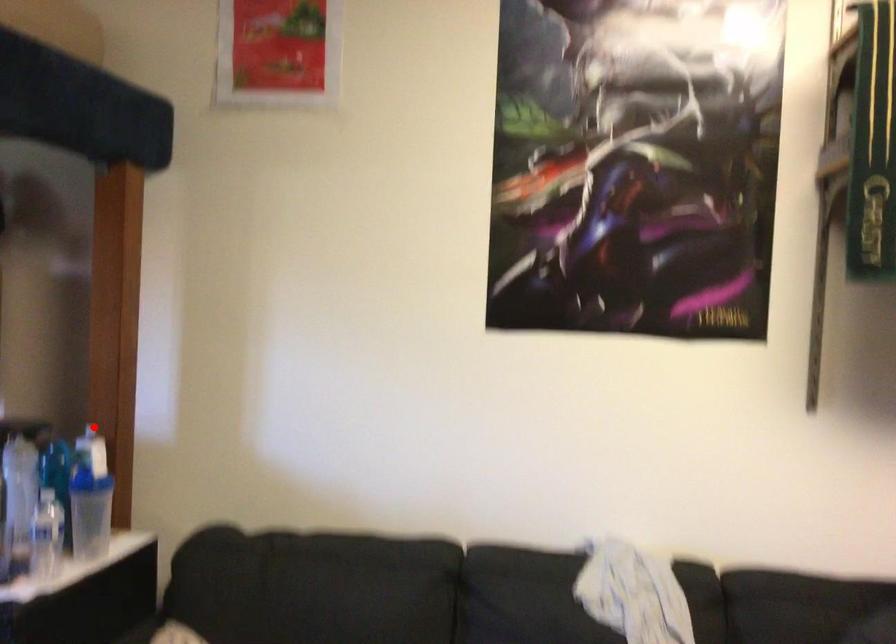
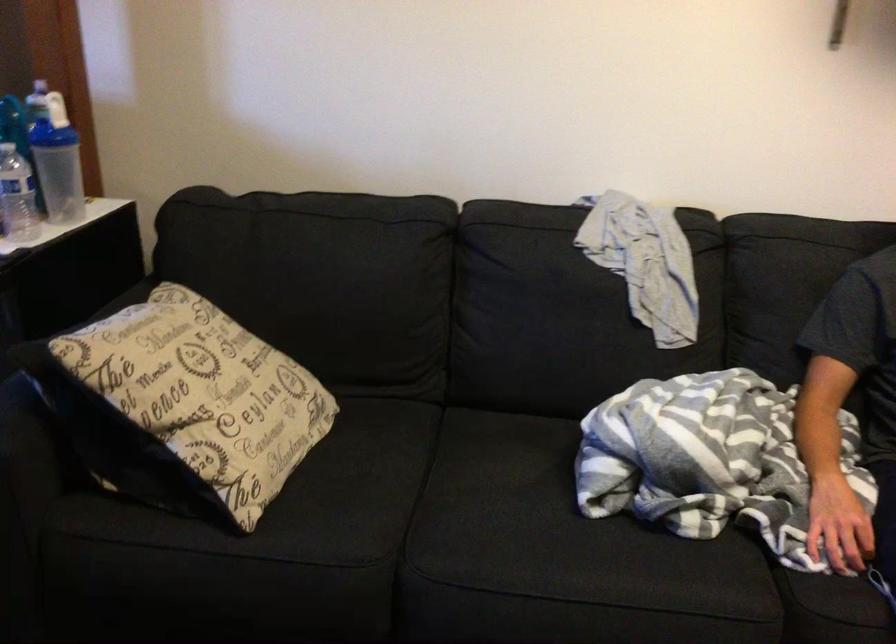
The point at the highlighted location is marked in the first image. Where is the corresponding point in the second image?

(40, 80)